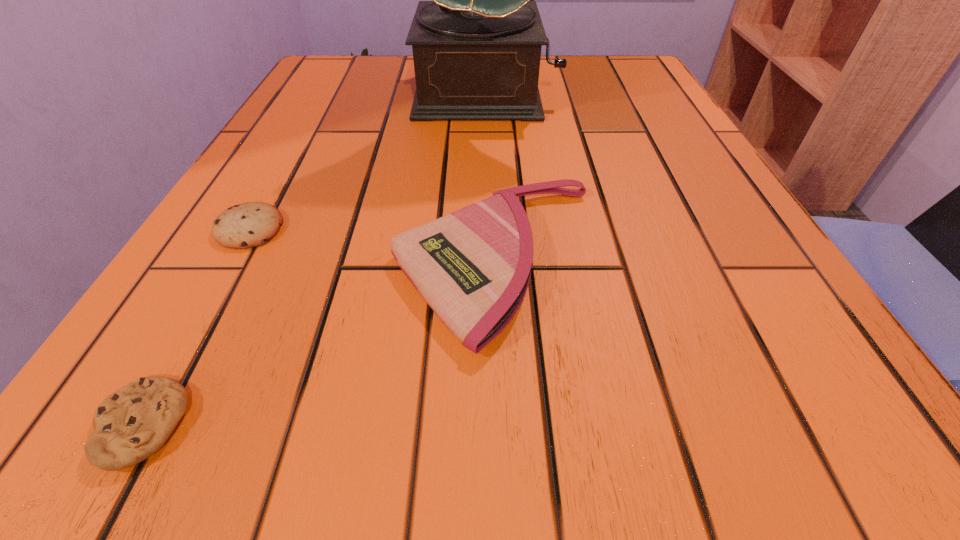
What are the coordinates of `object positioned at the near edge` in the screenshot? It's located at (134, 422).

You are a GUI agent. You are given a task and a screenshot of the screen. Output one action in this format:
    pyautogui.click(x=<x>, y=<y>)
    Task: Click on the object that is at the near left corner
    
    Given the screenshot: What is the action you would take?
    pyautogui.click(x=134, y=422)

In order to click on vacant space at the left edge of the desktop in this screenshot , I will do `click(303, 107)`.

At what (x,y) coordinates should I click in order to perform the action: click on vacant region at the right edge of the desktop. Please return your answer as a coordinate pair (x, y). Looking at the image, I should click on (685, 138).

The image size is (960, 540). In order to click on free space at the far left corner in this screenshot , I will do `click(372, 84)`.

Locate an element on the screen. The height and width of the screenshot is (540, 960). free point at the near left corner is located at coordinates (215, 471).

In the image, there is a desktop. What are the coordinates of `vacant space at the far right corner` in the screenshot? It's located at (625, 87).

Locate an element on the screen. This screenshot has width=960, height=540. vacant space at the near right corner of the desktop is located at coordinates (866, 440).

Where is `blank region between the farther cookie and the nearest object`? The image size is (960, 540). blank region between the farther cookie and the nearest object is located at coordinates (195, 327).

At what (x,y) coordinates should I click in order to perform the action: click on free area in between the third shortest object and the farther cookie. Please return your answer as a coordinate pair (x, y). This screenshot has width=960, height=540. Looking at the image, I should click on (373, 245).